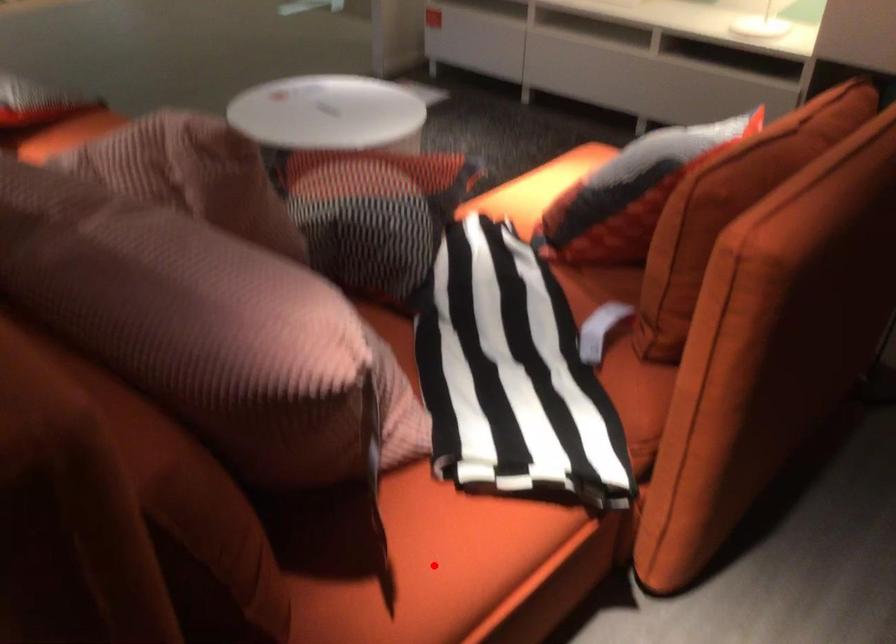
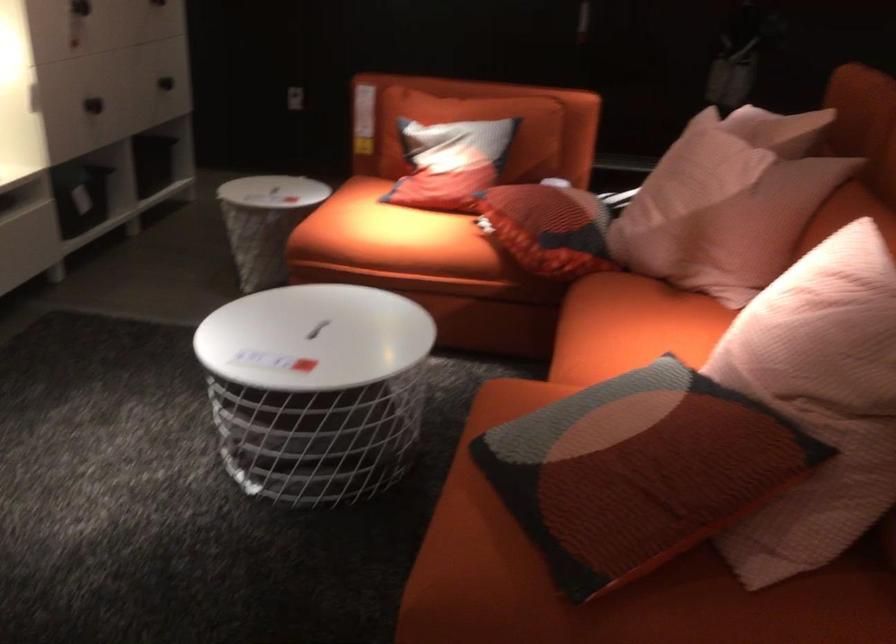
Question: I am providing you with two images of the same scene from different viewpoints. A red point is marked on the first image. Can you still see the location of the red point in image 2?

Choices:
 (A) Yes
 (B) No

Answer: (B)